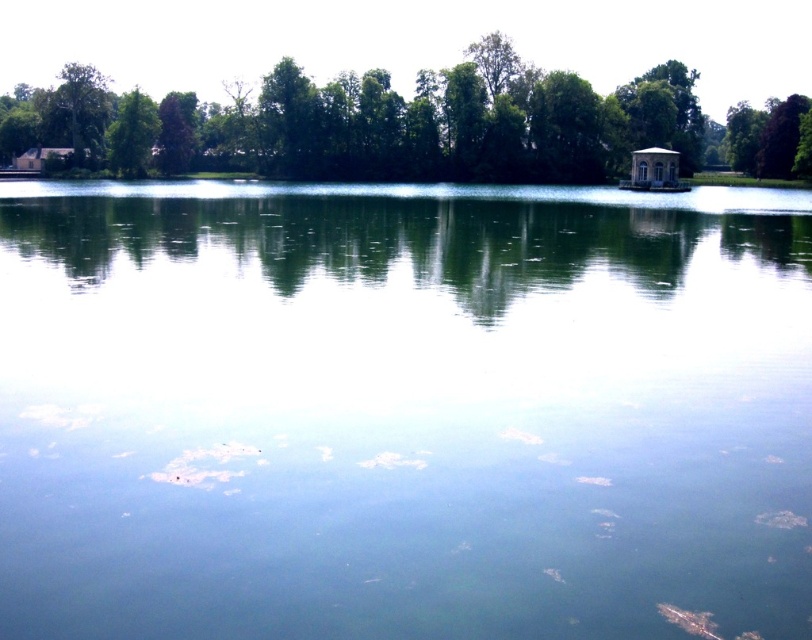
Looking at this image, you are standing at the lakeside and looking towards the center of the image. There is a point marked at coordinates point (435, 124). What object is located at this point?

The point (435, 124) indicates a green leafy tree at upper center.

You are standing at the lakeside and want to walk towards the clear water at center. Which direction should you move to avoid the green leafy tree at left?

The clear water at center is in front of the green leafy tree at left, so you should move towards the clear water at center directly since it is already positioned in front of the tree and there is no obstruction from the tree in that direction.